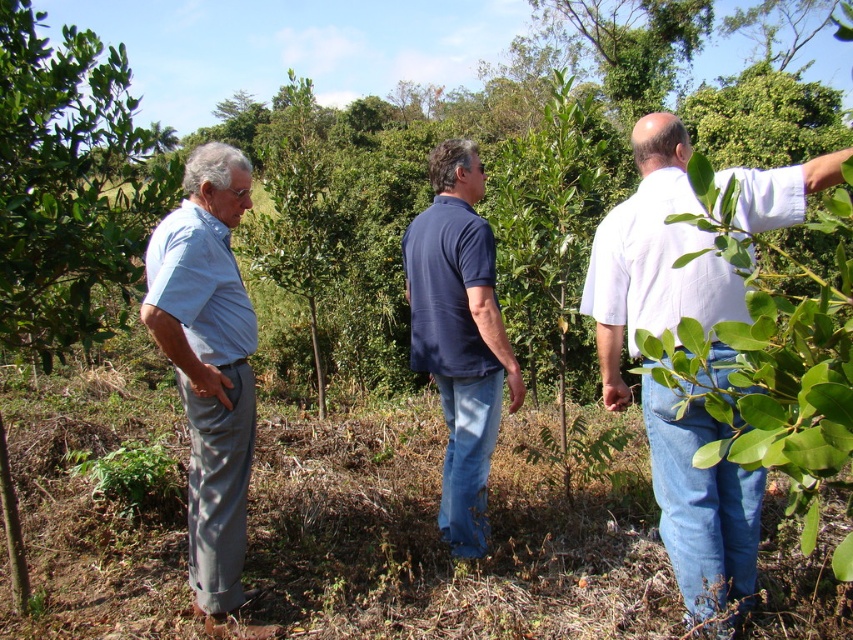
Question: Is white cotton shirt at right wider than green leafy tree at left?

Choices:
 (A) no
 (B) yes

Answer: (A)

Question: From the image, what is the correct spatial relationship of green leafy tree at left in relation to light blue cotton shirt at left?

Choices:
 (A) above
 (B) below

Answer: (A)

Question: Among these objects, which one is nearest to the camera?

Choices:
 (A) navy blue shirt at center
 (B) green leafy tree at left
 (C) white cotton shirt at right
 (D) light blue cotton shirt at left

Answer: (C)

Question: Is green leafy tree at left positioned at the back of navy blue shirt at center?

Choices:
 (A) no
 (B) yes

Answer: (A)

Question: Which of the following is the closest to the observer?

Choices:
 (A) light blue cotton shirt at left
 (B) white cotton shirt at right

Answer: (B)

Question: Which point is closer to the camera taking this photo?

Choices:
 (A) (431, 358)
 (B) (753, 586)

Answer: (B)